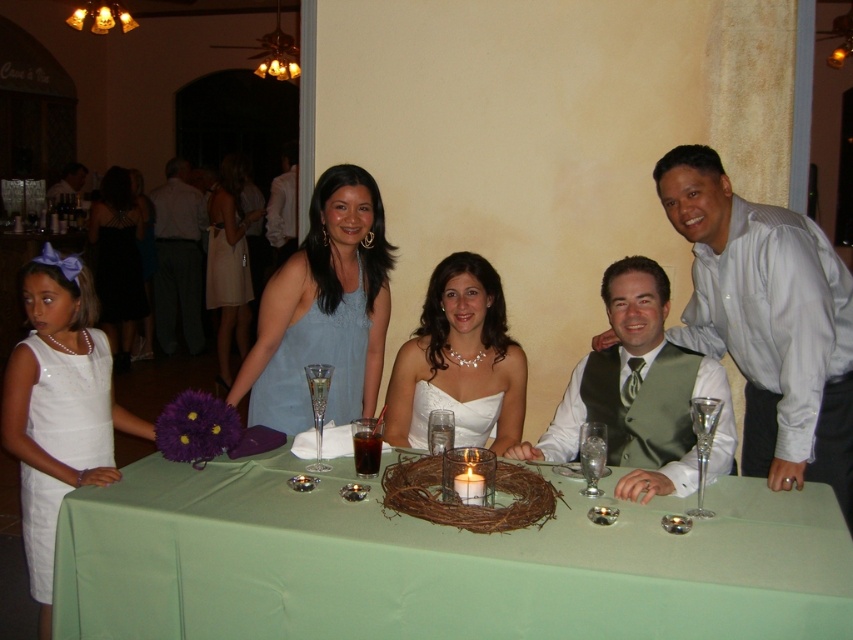
You are standing at the point labeled as point (228, 250) and want to move towards the point labeled as point (634, 381). Based on the scene description, will you be moving towards the table or away from it?

Point (634, 381) is in front of point (228, 250), so moving towards it would mean moving towards the table.

You are a photographer at the event and need to adjust the lighting to ensure both the green satin vest at center and the white satin dress at center are well lit. Given their sizes, which one might require more focused lighting to capture details?

The green satin vest at center is bigger than the white satin dress at center, so it might require more focused lighting to capture details due to its larger size.

You are a photographer at a formal event. You need to position two subjects so that one is slightly behind the other to create depth in the photo. Given the white satin dress at center and the gray fabric suit at left, which subject should be placed further back to ensure the shorter one is in front?

The white satin dress at center is not as tall as the gray fabric suit at left, so the shorter white satin dress at center should be placed in front, and the taller gray fabric suit at left should be positioned further back to create depth while maintaining visibility of both subjects.